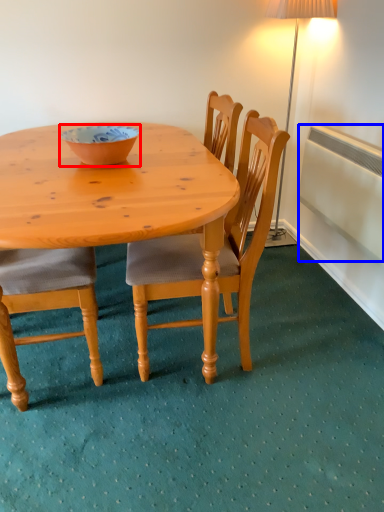
Question: Which object appears farthest to the camera in this image, bowl (highlighted by a red box) or radiator (highlighted by a blue box)?

Choices:
 (A) bowl
 (B) radiator

Answer: (B)